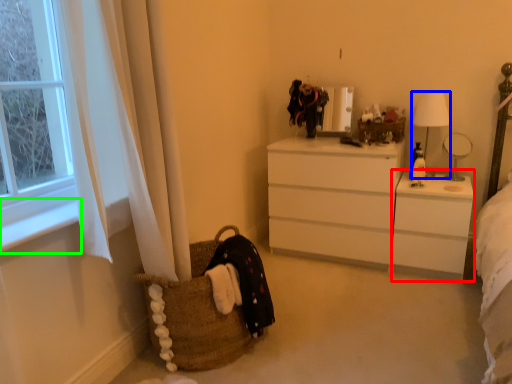
Question: Which object is positioned farthest from changing table (highlighted by a red box)? Select from lamp (highlighted by a blue box) and window sill (highlighted by a green box).

Choices:
 (A) lamp
 (B) window sill

Answer: (B)